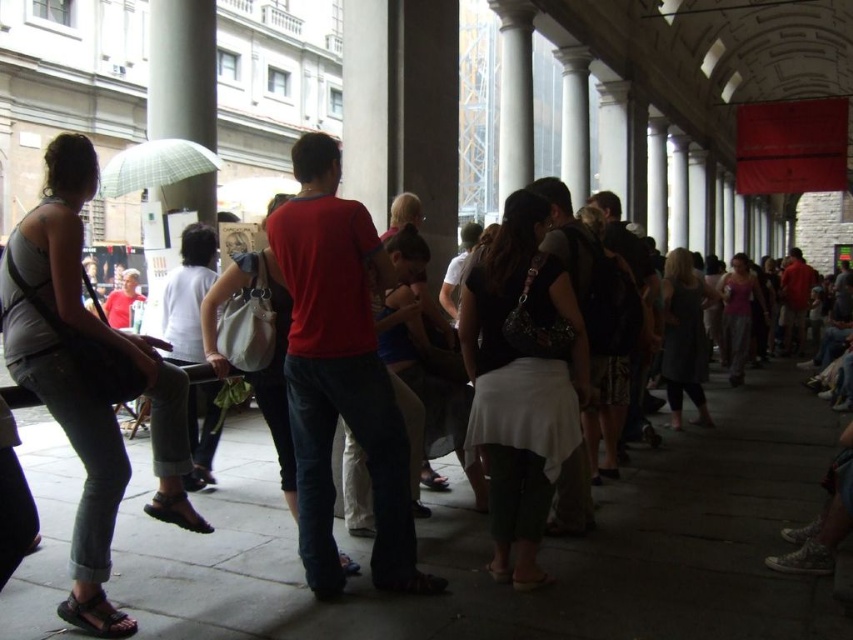
Question: From the image, what is the correct spatial relationship of white fabric bag at center in relation to pink fabric tank top at center?

Choices:
 (A) left
 (B) right

Answer: (A)

Question: Which point appears farthest from the camera in this image?

Choices:
 (A) (743, 356)
 (B) (677, 280)
 (C) (175, 326)
 (D) (474, 336)

Answer: (A)

Question: Estimate the real-world distances between objects in this image. Which object is closer to the pink fabric tank top at center?

Choices:
 (A) black textured skirt at center
 (B) white fabric bag at center

Answer: (A)

Question: Is white fabric bag at center thinner than plaid fabric umbrella at upper left?

Choices:
 (A) yes
 (B) no

Answer: (A)

Question: Which point is farther from the camera taking this photo?

Choices:
 (A) (184, 141)
 (B) (750, 296)
 (C) (467, 456)

Answer: (B)

Question: Is white fabric bag at center thinner than pink fabric tank top at center?

Choices:
 (A) yes
 (B) no

Answer: (A)